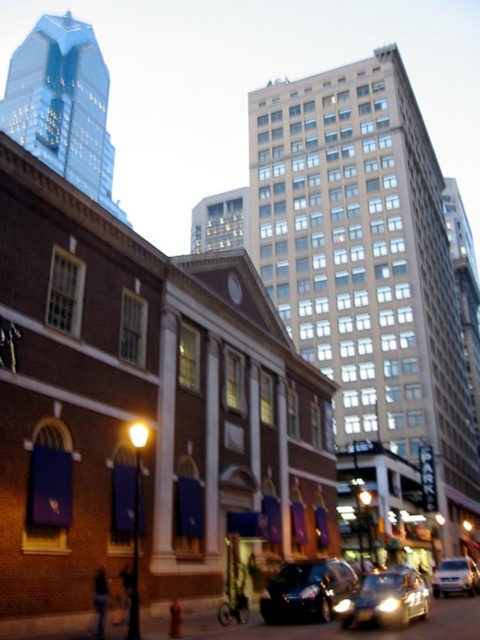
Between point (305, 586) and point (464, 557), which one is positioned in front?

Positioned in front is point (305, 586).

Describe the element at coordinates (305, 589) in the screenshot. I see `shiny black car at center` at that location.

Locate an element on the screen. The image size is (480, 640). shiny black car at center is located at coordinates (305, 589).

Between shiny black car at center and shiny black sedan at center, which one appears on the left side from the viewer's perspective?

From the viewer's perspective, shiny black car at center appears more on the left side.

Between shiny black car at center and shiny black sedan at center, which one is positioned lower?

Positioned lower is shiny black sedan at center.

Between point (323, 609) and point (408, 598), which one is positioned behind?

Point (323, 609)

At what (x,y) coordinates should I click in order to perform the action: click on shiny black car at center. Please return your answer as a coordinate pair (x, y). Looking at the image, I should click on (305, 589).

Is shiny black sedan at center smaller than silver metallic van at lower right?

Yes.

Does shiny black sedan at center come in front of silver metallic van at lower right?

Yes, shiny black sedan at center is closer to the viewer.

Is point (386, 572) farther from viewer compared to point (456, 557)?

No, it is not.

The height and width of the screenshot is (640, 480). I want to click on shiny black sedan at center, so click(x=385, y=598).